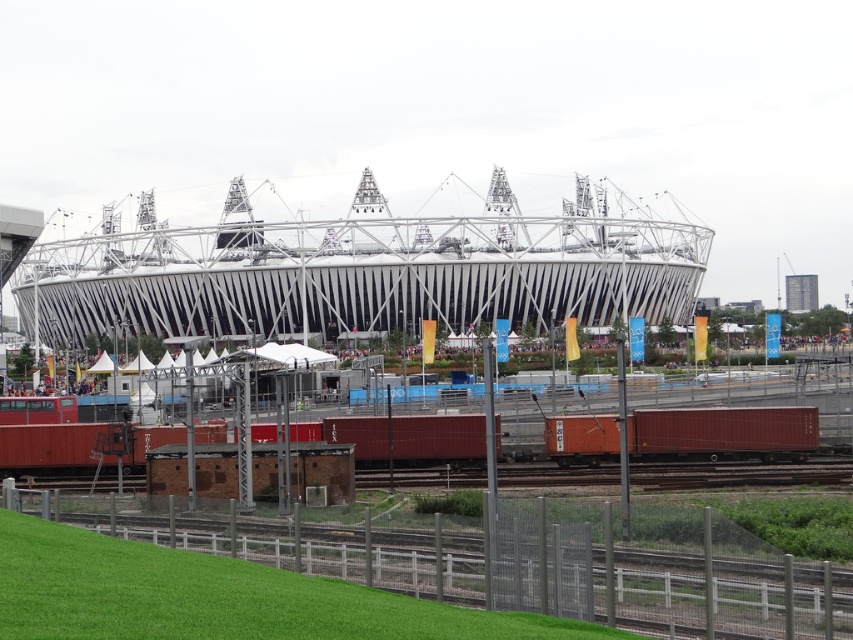
Question: Which point appears closest to the camera in this image?

Choices:
 (A) (689, 422)
 (B) (74, 637)

Answer: (B)

Question: Does green grass at lower left appear on the left side of orange matte container at center?

Choices:
 (A) no
 (B) yes

Answer: (B)

Question: Which point appears farthest from the camera in this image?

Choices:
 (A) (79, 449)
 (B) (109, 636)

Answer: (A)

Question: Is green grass at lower left to the right of orange matte container at center from the viewer's perspective?

Choices:
 (A) yes
 (B) no

Answer: (B)

Question: Can you confirm if green grass at lower left is positioned to the right of orange matte container at center?

Choices:
 (A) no
 (B) yes

Answer: (A)